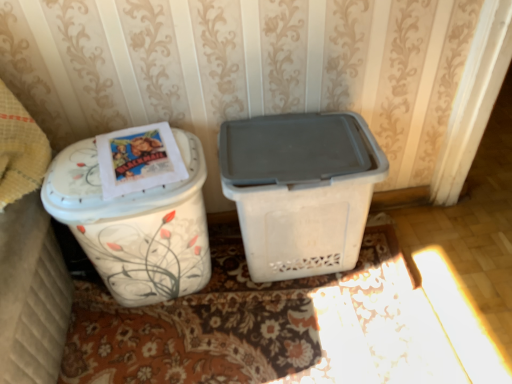
What do you see at coordinates (135, 224) in the screenshot? I see `white floral-patterned trash can at left, which ranks as the second waste container in right-to-left order` at bounding box center [135, 224].

This screenshot has width=512, height=384. What do you see at coordinates (307, 221) in the screenshot?
I see `white plastic bin at center, the first waste container when ordered from right to left` at bounding box center [307, 221].

In order to face floral-patterned carpet at lower center, should I rotate leftwards or rightwards?

Rotate left and turn 1.305 degrees.

What do you see at coordinates (28, 255) in the screenshot? This screenshot has width=512, height=384. I see `white floral-patterned container at left` at bounding box center [28, 255].

Image resolution: width=512 pixels, height=384 pixels. Find the location of `white floral-patterned trash can at left, which ranks as the second waste container in right-to-left order`. white floral-patterned trash can at left, which ranks as the second waste container in right-to-left order is located at coordinates (135, 224).

Does white plastic bin at center, the first waste container when ordered from right to left, have a smaller size compared to white floral-patterned trash can at left, which ranks as the second waste container in right-to-left order?

Yes, white plastic bin at center, the first waste container when ordered from right to left, is smaller than white floral-patterned trash can at left, which ranks as the second waste container in right-to-left order.

Is white plastic bin at center, acting as the second waste container starting from the left, facing away from white floral-patterned trash can at left, which ranks as the second waste container in right-to-left order?

No, white floral-patterned trash can at left, which ranks as the second waste container in right-to-left order, is not at the back of white plastic bin at center, acting as the second waste container starting from the left.

Is the position of white plastic bin at center, acting as the second waste container starting from the left, less distant than that of white floral-patterned trash can at left, which ranks as the second waste container in right-to-left order?

No, white plastic bin at center, acting as the second waste container starting from the left, is further to the viewer.

Is white floral-patterned container at left far from white floral-patterned trash can at left, the 1th waste container viewed from the left?

white floral-patterned container at left is actually quite close to white floral-patterned trash can at left, the 1th waste container viewed from the left.

Which object is wider, white floral-patterned container at left or white floral-patterned trash can at left, the 1th waste container viewed from the left?

With larger width is white floral-patterned container at left.

Does white floral-patterned container at left have a greater height compared to white floral-patterned trash can at left, the 1th waste container viewed from the left?

Indeed, white floral-patterned container at left has a greater height compared to white floral-patterned trash can at left, the 1th waste container viewed from the left.

From the image's perspective, which is below, white floral-patterned container at left or white floral-patterned trash can at left, the 1th waste container viewed from the left?

white floral-patterned trash can at left, the 1th waste container viewed from the left.

Measure the distance from white plastic bin at center, the first waste container when ordered from right to left, to floral-patterned carpet at lower center.

white plastic bin at center, the first waste container when ordered from right to left, and floral-patterned carpet at lower center are 27.48 centimeters apart from each other.

Which is less distant, [249,240] or [201,370]?

The point [201,370] is closer to the camera.

Which object is further away from the camera, white plastic bin at center, the first waste container when ordered from right to left, or floral-patterned carpet at lower center?

floral-patterned carpet at lower center is further from the camera.

Is white plastic bin at center, the first waste container when ordered from right to left, facing away from floral-patterned carpet at lower center?

white plastic bin at center, the first waste container when ordered from right to left, is not turned away from floral-patterned carpet at lower center.

Would you say white floral-patterned container at left is outside floral-patterned carpet at lower center?

That's correct, white floral-patterned container at left is outside of floral-patterned carpet at lower center.

Are white floral-patterned container at left and floral-patterned carpet at lower center making contact?

There is a gap between white floral-patterned container at left and floral-patterned carpet at lower center.

Which object is closer to the camera, white floral-patterned container at left or floral-patterned carpet at lower center?

white floral-patterned container at left is in front.

Is white floral-patterned container at left oriented towards floral-patterned carpet at lower center?

No, white floral-patterned container at left is not facing towards floral-patterned carpet at lower center.

Between white floral-patterned trash can at left, the 1th waste container viewed from the left, and floral-patterned carpet at lower center, which one has larger width?

floral-patterned carpet at lower center.

Who is smaller, white floral-patterned trash can at left, which ranks as the second waste container in right-to-left order, or floral-patterned carpet at lower center?

floral-patterned carpet at lower center.

Is white floral-patterned trash can at left, which ranks as the second waste container in right-to-left order, at the right side of floral-patterned carpet at lower center?

No.

Identify the location of waste container that is on the left side of floral-patterned carpet at lower center. (135, 224).

Is floral-patterned carpet at lower center to the left or to the right of white floral-patterned trash can at left, which ranks as the second waste container in right-to-left order, in the image?

Based on their positions, floral-patterned carpet at lower center is located to the right of white floral-patterned trash can at left, which ranks as the second waste container in right-to-left order.

Considering the positions of point (384, 382) and point (200, 170), is point (384, 382) closer or farther from the camera than point (200, 170)?

Clearly, point (384, 382) is more distant from the camera than point (200, 170).

Find the location of `doormat behind the white floral-patterned trash can at left, which ranks as the second waste container in right-to-left order`. doormat behind the white floral-patterned trash can at left, which ranks as the second waste container in right-to-left order is located at coordinates (268, 328).

Is floral-patterned carpet at lower center completely or partially outside of white floral-patterned trash can at left, the 1th waste container viewed from the left?

That's correct, floral-patterned carpet at lower center is outside of white floral-patterned trash can at left, the 1th waste container viewed from the left.

Can you confirm if white floral-patterned container at left is taller than white plastic bin at center, the first waste container when ordered from right to left?

Indeed, white floral-patterned container at left has a greater height compared to white plastic bin at center, the first waste container when ordered from right to left.

From a real-world perspective, which object stands above the other?

From a 3D spatial view, white floral-patterned container at left is above.

Where is `leftover on the left of white plastic bin at center, the first waste container when ordered from right to left`? This screenshot has width=512, height=384. leftover on the left of white plastic bin at center, the first waste container when ordered from right to left is located at coordinates (28, 255).

Where is `waste container on the right of white floral-patterned trash can at left, the 1th waste container viewed from the left`? This screenshot has height=384, width=512. waste container on the right of white floral-patterned trash can at left, the 1th waste container viewed from the left is located at coordinates (307, 221).

Where is `waste container below the white floral-patterned container at left (from the image's perspective)`? The image size is (512, 384). waste container below the white floral-patterned container at left (from the image's perspective) is located at coordinates (135, 224).

From the image, which object appears to be nearer to white floral-patterned trash can at left, the 1th waste container viewed from the left, white floral-patterned container at left or white plastic bin at center, acting as the second waste container starting from the left?

white floral-patterned container at left.

Based on their spatial positions, is floral-patterned carpet at lower center or white floral-patterned container at left closer to white plastic bin at center, the first waste container when ordered from right to left?

floral-patterned carpet at lower center.

When comparing their distances from white floral-patterned container at left, does white floral-patterned trash can at left, the 1th waste container viewed from the left, or white plastic bin at center, acting as the second waste container starting from the left, seem further?

white plastic bin at center, acting as the second waste container starting from the left.

When comparing their distances from floral-patterned carpet at lower center, does white floral-patterned container at left or white plastic bin at center, the first waste container when ordered from right to left, seem closer?

Based on the image, white plastic bin at center, the first waste container when ordered from right to left, appears to be nearer to floral-patterned carpet at lower center.

Looking at this image, from the image, which object appears to be farther from white floral-patterned container at left, white floral-patterned trash can at left, the 1th waste container viewed from the left, or floral-patterned carpet at lower center?

floral-patterned carpet at lower center is positioned further to the anchor white floral-patterned container at left.

When comparing their distances from floral-patterned carpet at lower center, does white floral-patterned container at left or white floral-patterned trash can at left, the 1th waste container viewed from the left, seem further?

The object further to floral-patterned carpet at lower center is white floral-patterned container at left.

From the image, which object appears to be nearer to white plastic bin at center, the first waste container when ordered from right to left, floral-patterned carpet at lower center or white floral-patterned trash can at left, the 1th waste container viewed from the left?

Among the two, floral-patterned carpet at lower center is located nearer to white plastic bin at center, the first waste container when ordered from right to left.

Considering their positions, is white floral-patterned trash can at left, which ranks as the second waste container in right-to-left order, positioned closer to white plastic bin at center, the first waste container when ordered from right to left, than white floral-patterned container at left?

white floral-patterned trash can at left, which ranks as the second waste container in right-to-left order, lies closer to white plastic bin at center, the first waste container when ordered from right to left, than the other object.

In order to click on waste container between white floral-patterned container at left and white plastic bin at center, acting as the second waste container starting from the left in this screenshot , I will do `click(135, 224)`.

The height and width of the screenshot is (384, 512). Find the location of `waste container between white floral-patterned container at left and floral-patterned carpet at lower center in the horizontal direction`. waste container between white floral-patterned container at left and floral-patterned carpet at lower center in the horizontal direction is located at coordinates (135, 224).

I want to click on doormat between white floral-patterned trash can at left, which ranks as the second waste container in right-to-left order, and white plastic bin at center, acting as the second waste container starting from the left, in the horizontal direction, so click(268, 328).

Image resolution: width=512 pixels, height=384 pixels. Find the location of `doormat located between white floral-patterned container at left and white plastic bin at center, acting as the second waste container starting from the left, in the left-right direction`. doormat located between white floral-patterned container at left and white plastic bin at center, acting as the second waste container starting from the left, in the left-right direction is located at coordinates (268, 328).